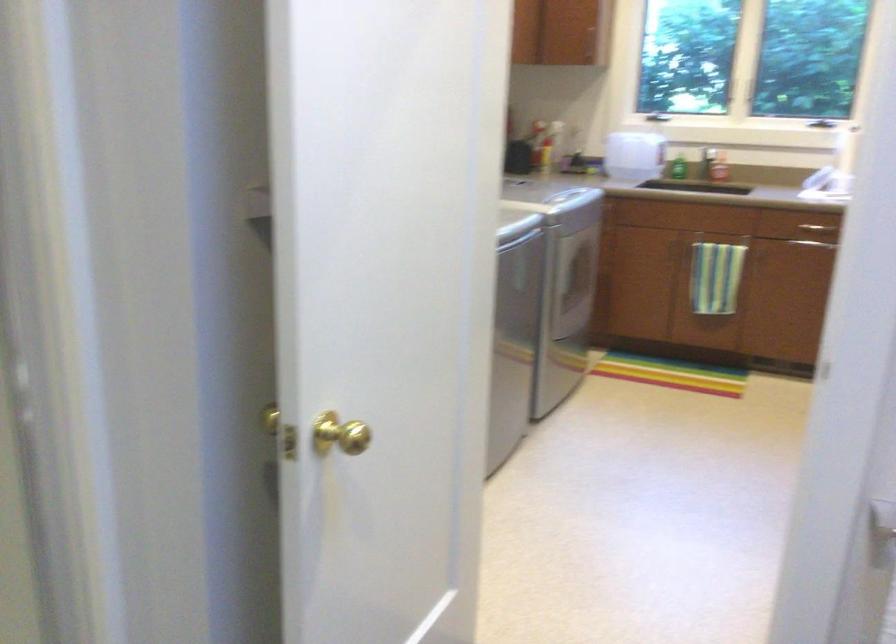
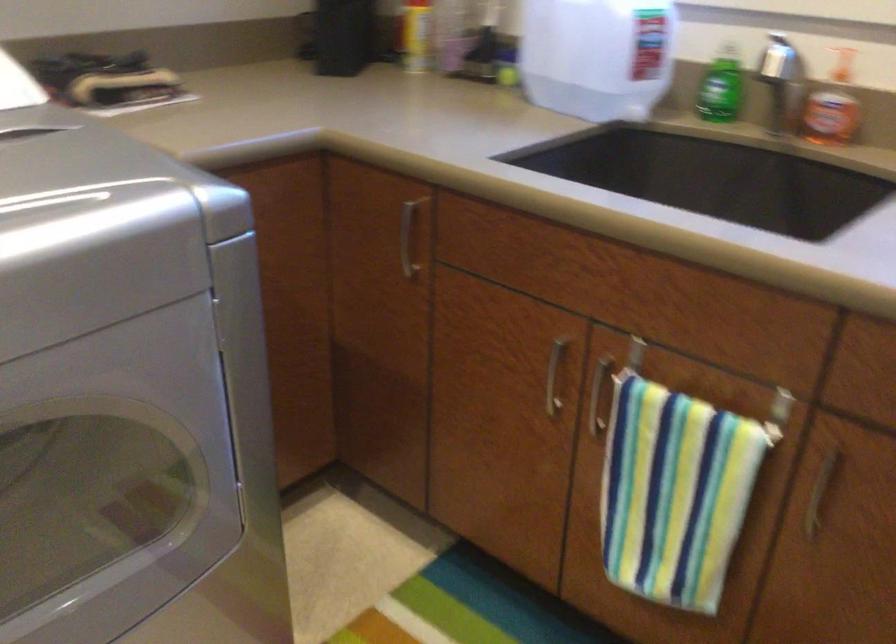
The point at (676, 167) is marked in the first image. Where is the corresponding point in the second image?

(718, 105)